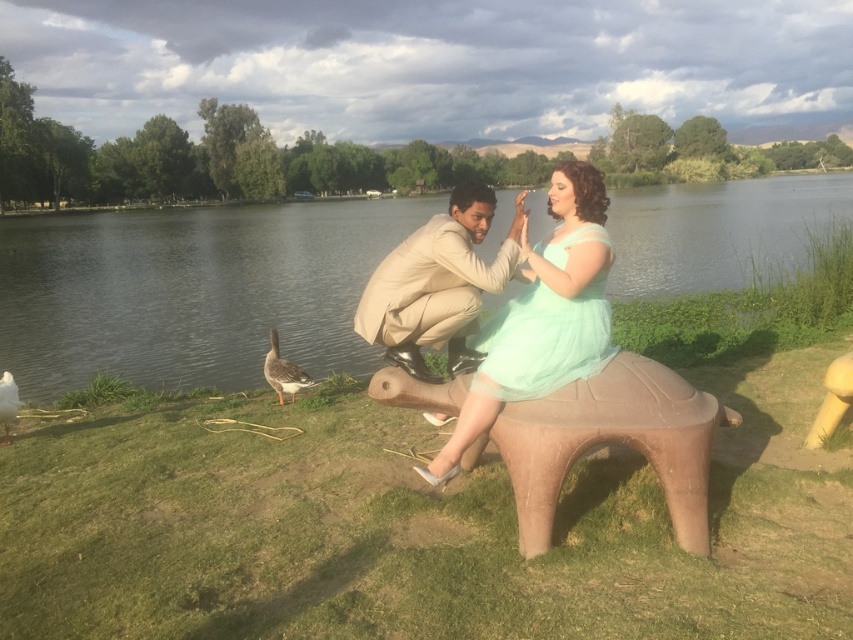
You are a photographer trying to capture the mint green tulle dress at center and the beige fabric suit at center in a portrait. Based on their positions, which one should you focus on first to ensure both are in frame?

The mint green tulle dress at center is below the beige fabric suit at center, so you should focus on the beige fabric suit at center first to ensure both are in frame.

You are standing at the edge of the lake and want to locate the smooth brown water at center. According to the coordinates provided, in which direction should you look?

You should look towards the point at coordinates 0.456 on the x axis and 0.225 on the y axis to locate the smooth brown water at center.

You are a photographer standing at the edge of the lake. You want to take a photo that includes both the matte brown bench at center and the brown feathered goose at lower left. Which object should you adjust your camera angle to focus on first to ensure both are in frame?

You should focus on the matte brown bench at center first because it is closer to the viewer than the brown feathered goose at lower left, so adjusting the angle to include it will naturally bring the goose into the frame as well.